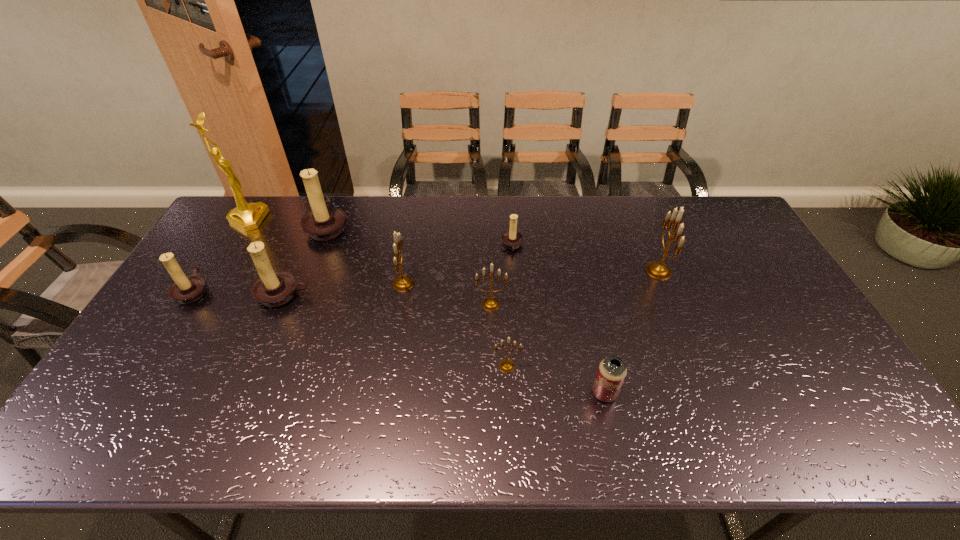
Image resolution: width=960 pixels, height=540 pixels. Find the location of `free area in between the third smallest brown candle holder and the smallest gold candelabrum`. free area in between the third smallest brown candle holder and the smallest gold candelabrum is located at coordinates (396, 330).

Identify the location of vacant space in between the smallest gold candelabrum and the rightmost brown candle holder. (510, 306).

Locate an element on the screen. This screenshot has width=960, height=540. vacant area that lies between the fifth object from left to right and the award is located at coordinates (325, 252).

The image size is (960, 540). Find the location of `empty space between the nearest candelabrum and the biggest gold candelabrum`. empty space between the nearest candelabrum and the biggest gold candelabrum is located at coordinates (583, 319).

Find the location of a particular element. unoccupied position between the rightmost object and the third biggest gold candelabrum is located at coordinates (575, 288).

Find the location of `unoccupied area between the rightmost object and the leftmost gold candelabrum`. unoccupied area between the rightmost object and the leftmost gold candelabrum is located at coordinates (531, 278).

What are the coordinates of `vacant area that lies between the second biggest brown candle holder and the nearest object` in the screenshot? It's located at (444, 344).

Where is `vacant space that's between the second biggest brown candle holder and the leftmost brown candle holder`? vacant space that's between the second biggest brown candle holder and the leftmost brown candle holder is located at coordinates (238, 293).

Identify which object is the sixth nearest to the rightmost gold candelabrum. Please provide its 2D coordinates. Your answer should be formatted as a tuple, i.e. [(x, y)], where the tuple contains the x and y coordinates of a point satisfying the conditions above.

[(324, 222)]

Identify which object is the seventh closest to the beer can. Please provide its 2D coordinates. Your answer should be formatted as a tuple, i.e. [(x, y)], where the tuple contains the x and y coordinates of a point satisfying the conditions above.

[(324, 222)]